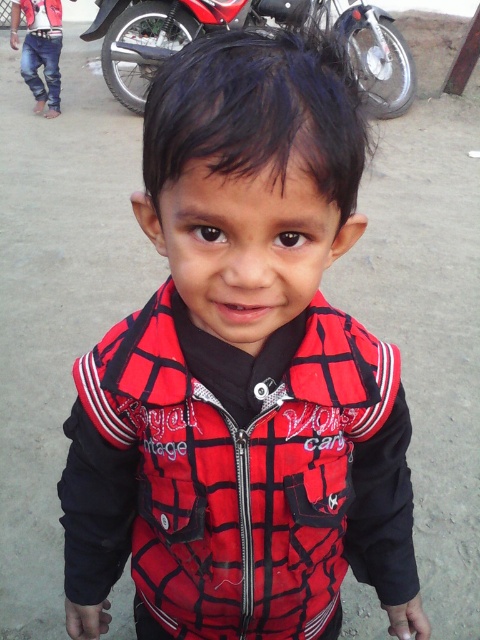
You are a photographer trying to capture a clear shot of the metallic red motorcycle at upper center and the jeans at left. Which object is positioned closer to your camera lens?

The metallic red motorcycle at upper center is closer to the viewer than the jeans at left, so the motorcycle will appear closer to the camera lens.

You are a photographer trying to capture the metallic red motorcycle at upper center in the center of your photo frame. Given its current position at point coordinates, can you determine if it is already centered?

The metallic red motorcycle at upper center is located at coordinates point (243, 26). Since the center of the frame is typically at point (240, 320), the motorcycle is not centered as its coordinates are significantly different from the center point.